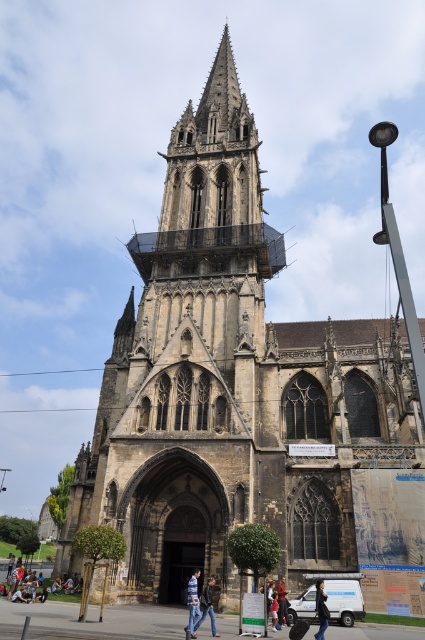
You are a visitor standing in front of the Gothic church and see the denim jacket at lower center and the dark blue jeans at center. Which item is covering the other?

The denim jacket at lower center is positioned over the dark blue jeans at center, so the denim jacket is covering the dark blue jeans.

You are a photographer planning to take a portrait of a person wearing a striped shirt at center and dark blue jeans at lower center. Which clothing item should you focus on if you want to emphasize the larger one?

The striped shirt at center has a larger size compared to the dark blue jeans at lower center, so you should focus on the striped shirt at center to emphasize its larger size.

You are standing in front of the Gothic church and notice two points marked on its facade. Which of the two points, point (204, 600) or point (285, 611), is closer to you?

Point (204, 600) is closer to the viewer than point (285, 611).